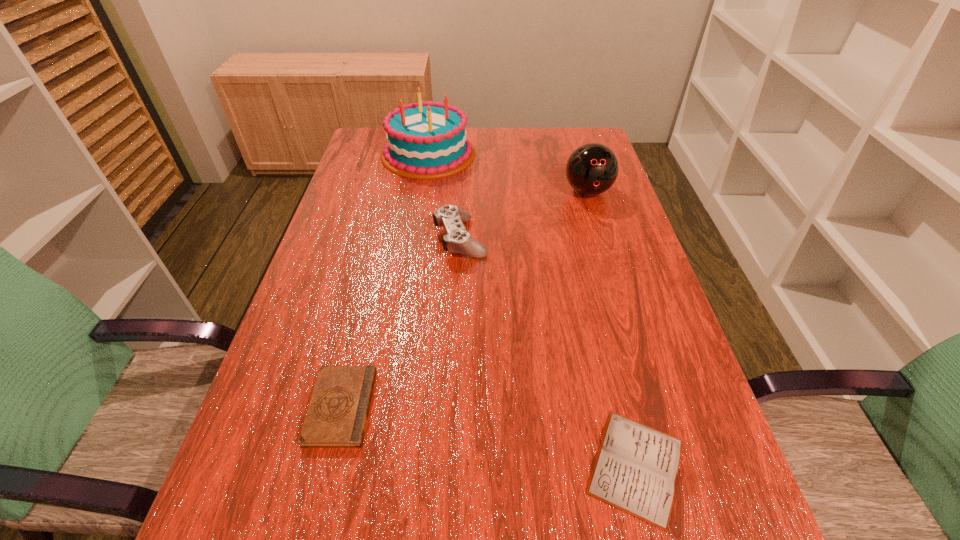
The image size is (960, 540). I want to click on free spot between the shortest object and the third tallest object, so click(548, 352).

The image size is (960, 540). In order to click on free space that is in between the tallest object and the left diary in this screenshot , I will do `click(385, 280)`.

Identify which object is the third nearest to the tallest object. Please provide its 2D coordinates. Your answer should be formatted as a tuple, i.e. [(x, y)], where the tuple contains the x and y coordinates of a point satisfying the conditions above.

[(337, 415)]

Locate which object ranks fourth in proximity to the fourth shortest object. Please provide its 2D coordinates. Your answer should be formatted as a tuple, i.e. [(x, y)], where the tuple contains the x and y coordinates of a point satisfying the conditions above.

[(337, 415)]

Image resolution: width=960 pixels, height=540 pixels. In order to click on vacant position in the image that satisfies the following two spatial constraints: 1. on the front side of the third farthest object; 2. on the left side of the birthday cake in this screenshot , I will do 415,238.

Find the location of `blank space that satisfies the following two spatial constraints: 1. on the back side of the shorter diary; 2. on the spine side of the left diary`. blank space that satisfies the following two spatial constraints: 1. on the back side of the shorter diary; 2. on the spine side of the left diary is located at coordinates (621, 407).

You are a GUI agent. You are given a task and a screenshot of the screen. Output one action in this format:
    pyautogui.click(x=<x>, y=<y>)
    Task: Click on the free point that satisfies the following two spatial constraints: 1. on the front side of the control; 2. on the spine side of the left diary
    
    Given the screenshot: What is the action you would take?
    pyautogui.click(x=452, y=407)

The height and width of the screenshot is (540, 960). I want to click on free space that satisfies the following two spatial constraints: 1. on the spine side of the right diary; 2. on the right side of the taller diary, so click(326, 466).

The height and width of the screenshot is (540, 960). Identify the location of vacant space that satisfies the following two spatial constraints: 1. on the spine side of the second shortest object; 2. on the back side of the shorter diary. (326, 466).